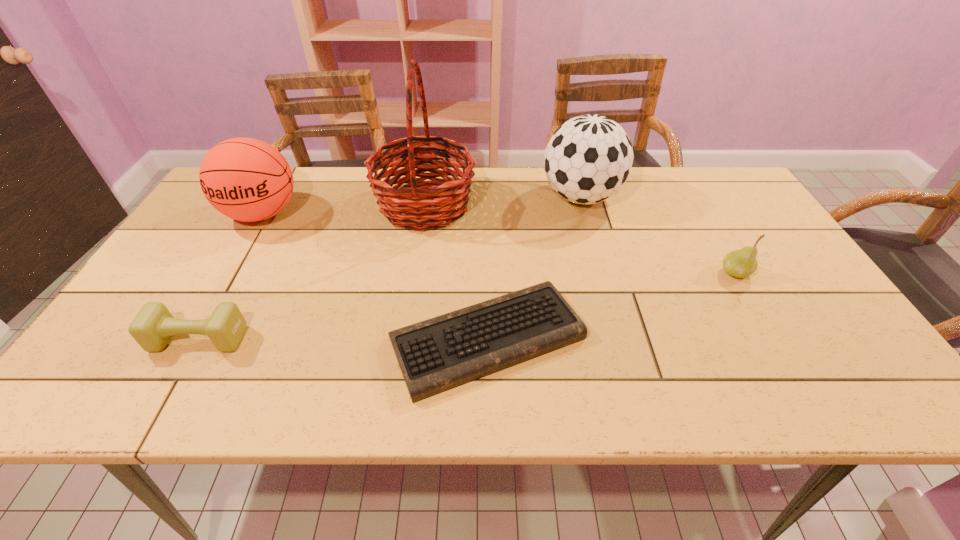
You are a GUI agent. You are given a task and a screenshot of the screen. Output one action in this format:
    pyautogui.click(x=<x>, y=<y>)
    Task: Click on the free space between the dumbbell and the soccer ball
    The height and width of the screenshot is (540, 960).
    Given the screenshot: What is the action you would take?
    pyautogui.click(x=390, y=268)

Find the location of a particular element. The width and height of the screenshot is (960, 540). free space that is in between the basketball and the rightmost object is located at coordinates (498, 244).

Where is `empty location between the basket and the computer keyboard`? empty location between the basket and the computer keyboard is located at coordinates (456, 272).

Where is `free point between the soccer ball and the pear`? free point between the soccer ball and the pear is located at coordinates (658, 235).

Identify which object is located as the nearest to the basketball. Please provide its 2D coordinates. Your answer should be formatted as a tuple, i.e. [(x, y)], where the tuple contains the x and y coordinates of a point satisfying the conditions above.

[(409, 207)]

Choose which object is the nearest neighbor to the rightmost object. Please provide its 2D coordinates. Your answer should be formatted as a tuple, i.e. [(x, y)], where the tuple contains the x and y coordinates of a point satisfying the conditions above.

[(588, 159)]

Identify the location of free space that satisfies the following two spatial constraints: 1. on the side with logo of the basketball; 2. on the right side of the dumbbell. (190, 339).

At what (x,y) coordinates should I click in order to perform the action: click on blank area in the image that satisfies the following two spatial constraints: 1. on the side with logo of the basketball; 2. on the right side of the shortest object. Please return your answer as a coordinate pair (x, y). Looking at the image, I should click on (191, 338).